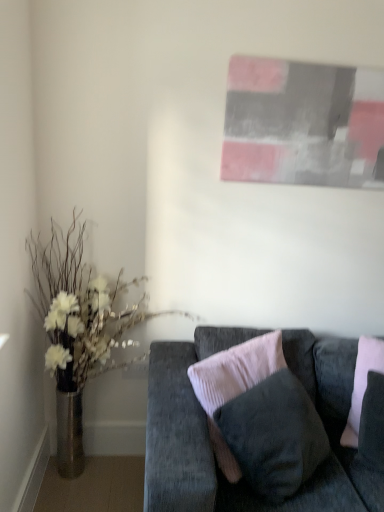
Question: Considering the relative sizes of metallic vase at left and velvet pink pillow at center in the image provided, is metallic vase at left thinner than velvet pink pillow at center?

Choices:
 (A) no
 (B) yes

Answer: (A)

Question: From a real-world perspective, is metallic vase at left located beneath velvet pink pillow at center?

Choices:
 (A) no
 (B) yes

Answer: (A)

Question: Would you say metallic vase at left is outside velvet pink pillow at center?

Choices:
 (A) yes
 (B) no

Answer: (A)

Question: Is metallic vase at left wider than velvet pink pillow at center?

Choices:
 (A) no
 (B) yes

Answer: (B)

Question: Is metallic vase at left shorter than velvet pink pillow at center?

Choices:
 (A) yes
 (B) no

Answer: (B)

Question: Looking at the image, does velvet pink pillow at center seem bigger or smaller compared to metallic vase at left?

Choices:
 (A) small
 (B) big

Answer: (A)

Question: Is point (375, 350) closer or farther from the camera than point (71, 233)?

Choices:
 (A) farther
 (B) closer

Answer: (B)

Question: Considering the positions of velvet pink pillow at center and metallic vase at left in the image, is velvet pink pillow at center wider or thinner than metallic vase at left?

Choices:
 (A) wide
 (B) thin

Answer: (B)

Question: From their relative heights in the image, would you say velvet pink pillow at center is taller or shorter than metallic vase at left?

Choices:
 (A) short
 (B) tall

Answer: (A)

Question: From their relative heights in the image, would you say metallic vase at left is taller or shorter than velvet dark gray couch at lower right?

Choices:
 (A) tall
 (B) short

Answer: (A)

Question: Based on their positions, is metallic vase at left located to the left or right of velvet dark gray couch at lower right?

Choices:
 (A) left
 (B) right

Answer: (A)

Question: From the image's perspective, is metallic vase at left above or below velvet dark gray couch at lower right?

Choices:
 (A) below
 (B) above

Answer: (B)

Question: Is metallic vase at left spatially inside velvet dark gray couch at lower right, or outside of it?

Choices:
 (A) outside
 (B) inside

Answer: (A)

Question: From their relative heights in the image, would you say metallic vase at left is taller or shorter than velvet pink pillow at center?

Choices:
 (A) short
 (B) tall

Answer: (B)

Question: Choose the correct answer: Is metallic vase at left inside velvet pink pillow at center or outside it?

Choices:
 (A) inside
 (B) outside

Answer: (B)